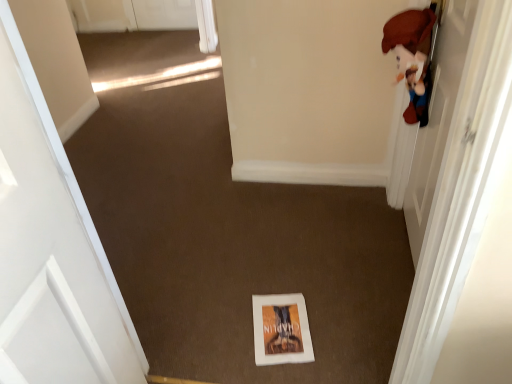
Question: Are white matte door at left, the 1th door positioned from the left, and white paper book at center beside each other?

Choices:
 (A) yes
 (B) no

Answer: (B)

Question: Is white paper book at center located within white matte door at left, positioned as the 2th door in right-to-left order?

Choices:
 (A) yes
 (B) no

Answer: (B)

Question: Is white matte door at left, positioned as the 2th door in right-to-left order, not close to white paper book at center?

Choices:
 (A) no
 (B) yes

Answer: (A)

Question: Is white matte door at left, positioned as the 2th door in right-to-left order, thinner than white paper book at center?

Choices:
 (A) yes
 (B) no

Answer: (A)

Question: From the image's perspective, is white matte door at left, the 1th door positioned from the left, below white paper book at center?

Choices:
 (A) no
 (B) yes

Answer: (A)

Question: Considering the relative positions of white matte door at left, positioned as the 2th door in right-to-left order, and white glossy door at upper right, which is counted as the first door, starting from the right, in the image provided, is white matte door at left, positioned as the 2th door in right-to-left order, to the left or to the right of white glossy door at upper right, which is counted as the first door, starting from the right,?

Choices:
 (A) left
 (B) right

Answer: (A)

Question: Does point (83, 337) appear closer or farther from the camera than point (490, 86)?

Choices:
 (A) closer
 (B) farther

Answer: (B)

Question: In terms of height, does white matte door at left, the 1th door positioned from the left, look taller or shorter compared to white glossy door at upper right, positioned as the 2th door in left-to-right order?

Choices:
 (A) tall
 (B) short

Answer: (A)

Question: From the image's perspective, is white matte door at left, positioned as the 2th door in right-to-left order, positioned above or below white glossy door at upper right, positioned as the 2th door in left-to-right order?

Choices:
 (A) above
 (B) below

Answer: (B)

Question: Is white paper book at center inside the boundaries of white glossy door at upper right, which is counted as the first door, starting from the right, or outside?

Choices:
 (A) outside
 (B) inside

Answer: (A)

Question: Looking at their shapes, would you say white paper book at center is wider or thinner than white glossy door at upper right, positioned as the 2th door in left-to-right order?

Choices:
 (A) thin
 (B) wide

Answer: (B)

Question: From a real-world perspective, is white paper book at center above or below white glossy door at upper right, which is counted as the first door, starting from the right?

Choices:
 (A) below
 (B) above

Answer: (A)

Question: Is white paper book at center bigger or smaller than white glossy door at upper right, positioned as the 2th door in left-to-right order?

Choices:
 (A) big
 (B) small

Answer: (B)

Question: Is white glossy door at upper right, which is counted as the first door, starting from the right, inside the boundaries of white matte door at left, positioned as the 2th door in right-to-left order, or outside?

Choices:
 (A) inside
 (B) outside

Answer: (B)

Question: From their relative heights in the image, would you say white glossy door at upper right, positioned as the 2th door in left-to-right order, is taller or shorter than white matte door at left, positioned as the 2th door in right-to-left order?

Choices:
 (A) short
 (B) tall

Answer: (A)